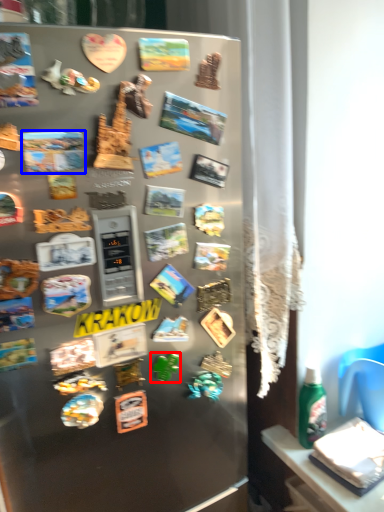
Question: Which object appears closest to the camera in this image, stuff (highlighted by a red box) or comic book (highlighted by a blue box)?

Choices:
 (A) stuff
 (B) comic book

Answer: (B)